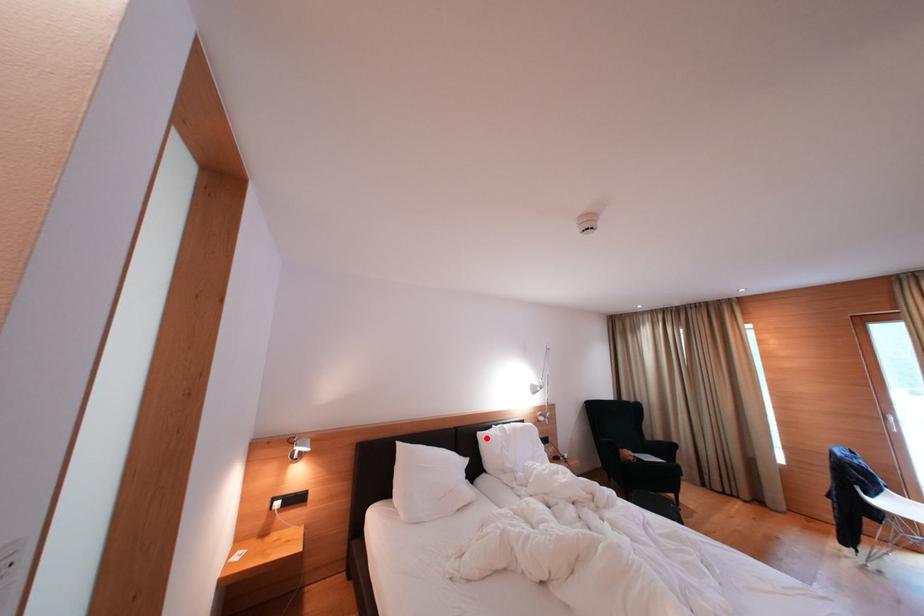
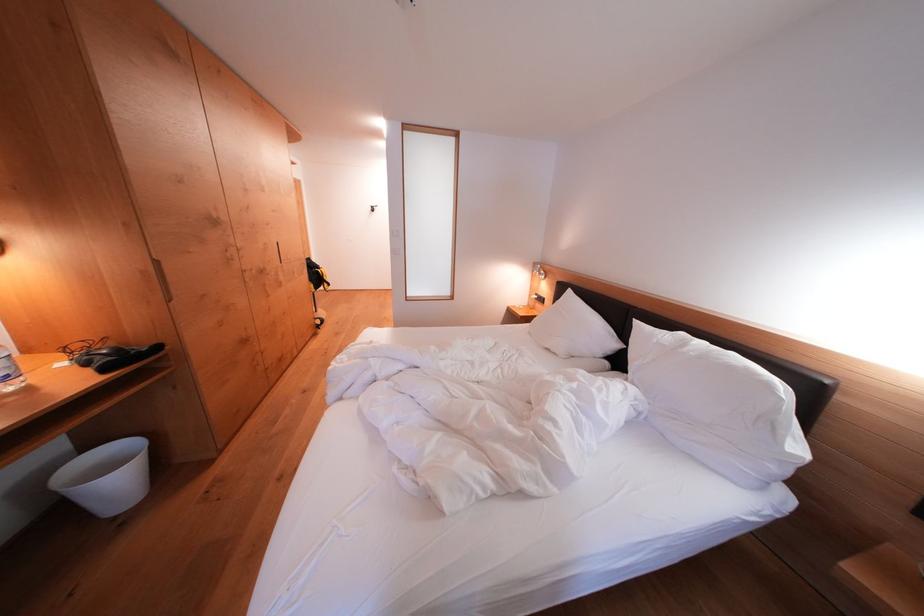
Question: I am providing you with two images of the same scene from different viewpoints. A red point is marked on the first image. Can you still see the location of the red point in image 2?

Choices:
 (A) Yes
 (B) No

Answer: (A)